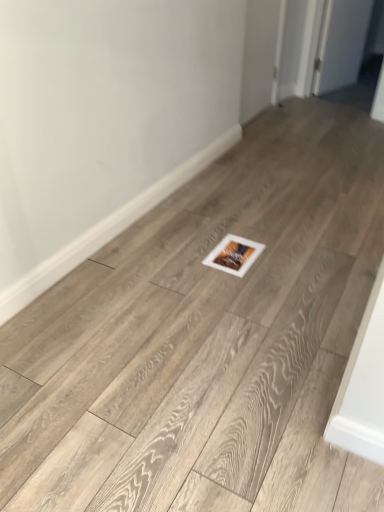
I want to click on free space above white matte picture frame at center (from a real-world perspective), so click(233, 247).